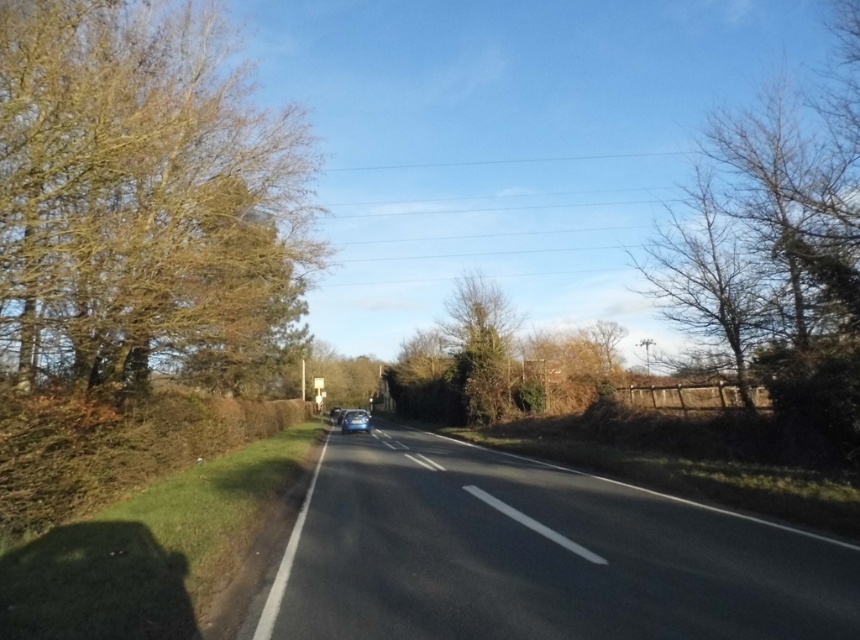
Question: Which point appears closest to the camera in this image?

Choices:
 (A) (345, 432)
 (B) (422, 451)

Answer: (B)

Question: Is black asphalt road at center further to the viewer compared to green leafy tree at center?

Choices:
 (A) no
 (B) yes

Answer: (A)

Question: Which object appears farthest from the camera in this image?

Choices:
 (A) glossy blue car at center
 (B) black asphalt road at center

Answer: (A)

Question: Does brown leafy tree at left have a smaller size compared to glossy blue car at center?

Choices:
 (A) no
 (B) yes

Answer: (A)

Question: Is brown leafy tree at left further to the viewer compared to black asphalt road at center?

Choices:
 (A) yes
 (B) no

Answer: (A)

Question: Among these points, which one is nearest to the camera?

Choices:
 (A) (360, 419)
 (B) (852, 618)
 (C) (115, 74)

Answer: (B)